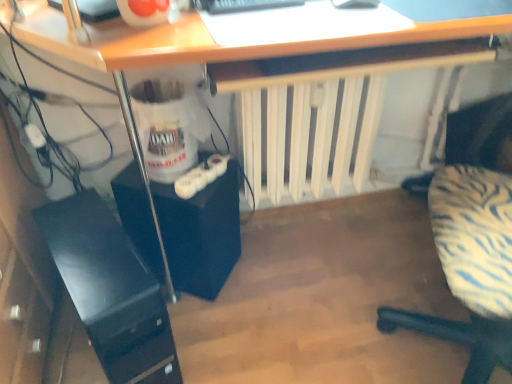
Find the location of a particular element. The height and width of the screenshot is (384, 512). vacant area located to the right-hand side of black matte computer tower at lower left, the second computer tower in the left-to-right sequence is located at coordinates (268, 284).